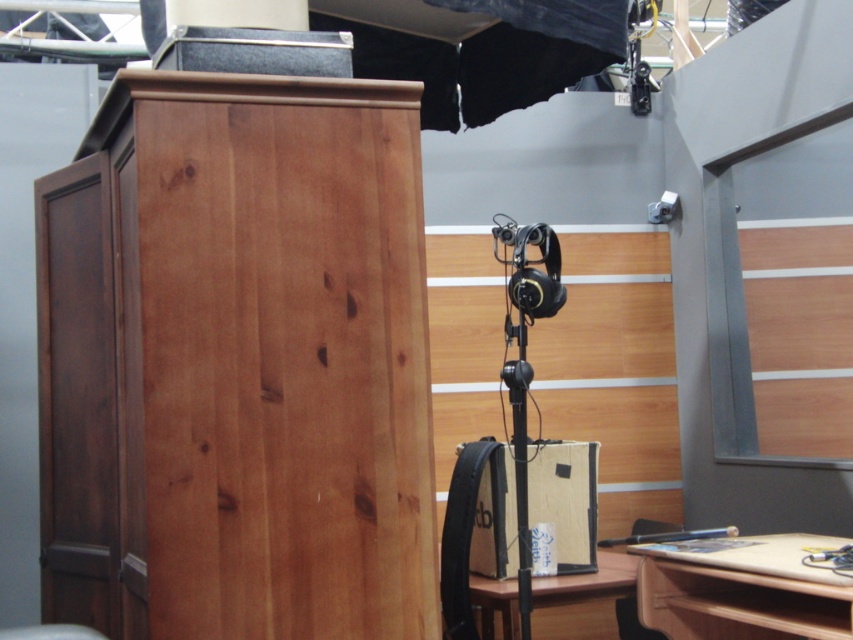
Question: Among these points, which one is farthest from the camera?

Choices:
 (A) (718, 632)
 (B) (585, 586)

Answer: (A)

Question: Is wooden desk at lower right smaller than wooden desk at lower center?

Choices:
 (A) no
 (B) yes

Answer: (A)

Question: Which of the following is the closest to the observer?

Choices:
 (A) wooden desk at lower center
 (B) wooden desk at lower right

Answer: (B)

Question: Which of the following is the farthest from the observer?

Choices:
 (A) (512, 636)
 (B) (700, 609)

Answer: (A)

Question: Is wooden desk at lower right bigger than wooden desk at lower center?

Choices:
 (A) yes
 (B) no

Answer: (A)

Question: Can you confirm if wooden desk at lower right is positioned above wooden desk at lower center?

Choices:
 (A) yes
 (B) no

Answer: (A)